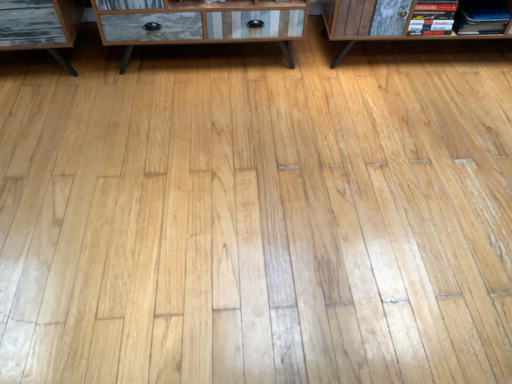
Question: Is hardcover book at upper right, arranged as the 1th book when viewed from the left, further to the viewer compared to wooden cabinet at center?

Choices:
 (A) no
 (B) yes

Answer: (B)

Question: Can you confirm if hardcover book at upper right, placed as the second book when sorted from right to left, is positioned to the right of wooden cabinet at center?

Choices:
 (A) yes
 (B) no

Answer: (A)

Question: Considering the relative sizes of hardcover book at upper right, arranged as the 1th book when viewed from the left, and wooden cabinet at center in the image provided, is hardcover book at upper right, arranged as the 1th book when viewed from the left, thinner than wooden cabinet at center?

Choices:
 (A) no
 (B) yes

Answer: (B)

Question: Does hardcover book at upper right, placed as the second book when sorted from right to left, have a smaller size compared to wooden cabinet at center?

Choices:
 (A) no
 (B) yes

Answer: (B)

Question: Is the surface of hardcover book at upper right, arranged as the 1th book when viewed from the left, in direct contact with wooden cabinet at center?

Choices:
 (A) yes
 (B) no

Answer: (B)

Question: From the image's perspective, does hardcover book at upper right, placed as the second book when sorted from right to left, appear lower than wooden cabinet at center?

Choices:
 (A) yes
 (B) no

Answer: (A)

Question: Is hardcover book at upper right, placed as the second book when sorted from right to left, to the left of matte black book at upper right, the second book from the left, from the viewer's perspective?

Choices:
 (A) yes
 (B) no

Answer: (A)

Question: Could you tell me if hardcover book at upper right, arranged as the 1th book when viewed from the left, is turned towards matte black book at upper right, the second book from the left?

Choices:
 (A) no
 (B) yes

Answer: (A)

Question: From a real-world perspective, is hardcover book at upper right, arranged as the 1th book when viewed from the left, over matte black book at upper right, which ranks as the 1th book in right-to-left order?

Choices:
 (A) no
 (B) yes

Answer: (B)

Question: Does hardcover book at upper right, placed as the second book when sorted from right to left, contain matte black book at upper right, the second book from the left?

Choices:
 (A) no
 (B) yes

Answer: (A)

Question: From a real-world perspective, is hardcover book at upper right, placed as the second book when sorted from right to left, beneath matte black book at upper right, the second book from the left?

Choices:
 (A) no
 (B) yes

Answer: (A)

Question: Considering the relative sizes of hardcover book at upper right, arranged as the 1th book when viewed from the left, and matte black book at upper right, the second book from the left, in the image provided, is hardcover book at upper right, arranged as the 1th book when viewed from the left, shorter than matte black book at upper right, the second book from the left,?

Choices:
 (A) no
 (B) yes

Answer: (A)

Question: Is wooden cabinet at center outside hardcover book at upper right, arranged as the 1th book when viewed from the left?

Choices:
 (A) no
 (B) yes

Answer: (B)